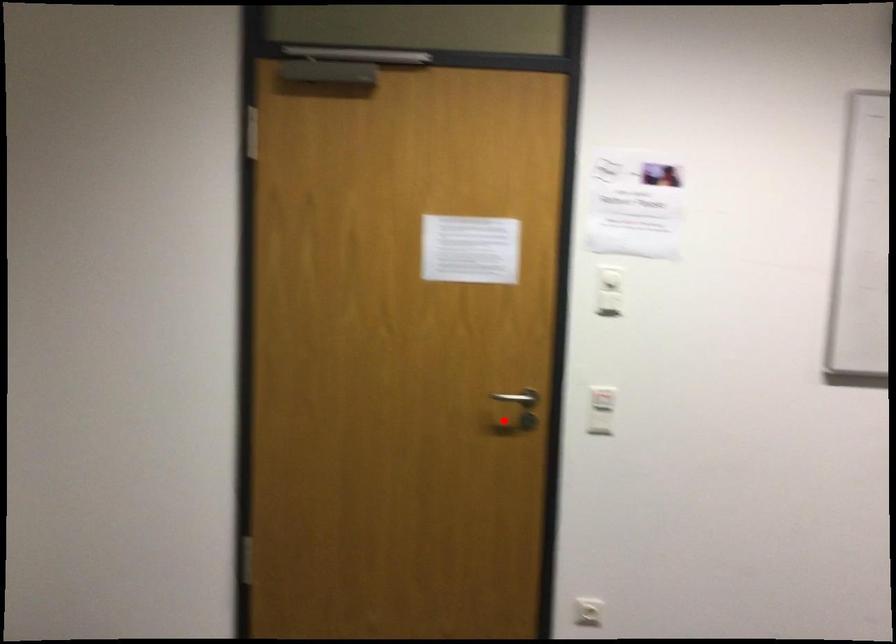
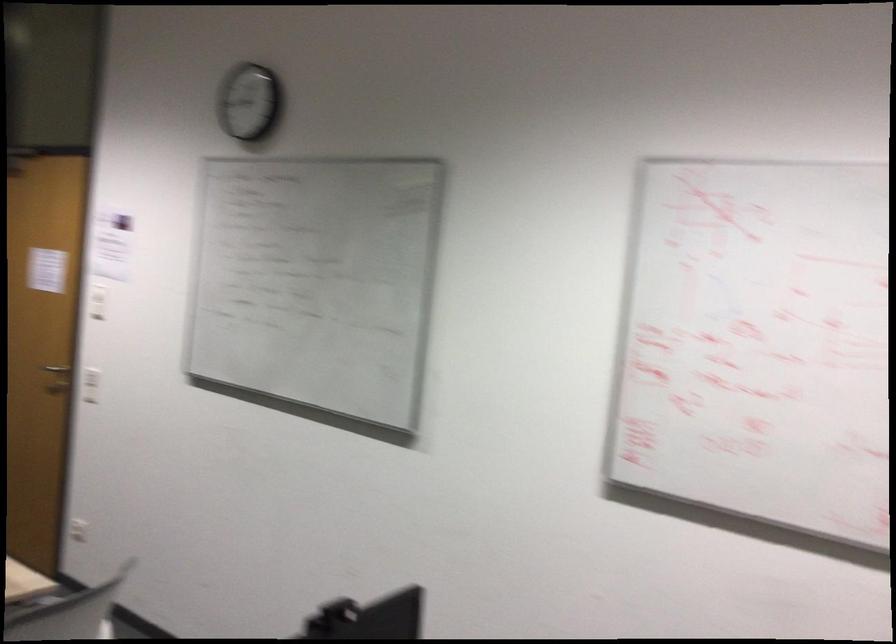
Question: I am providing you with two images of the same scene from different viewpoints. A red point is shown in image1. For the corresponding object point in image2, is it positioned nearer or farther from the camera?

Choices:
 (A) Nearer
 (B) Farther

Answer: (B)